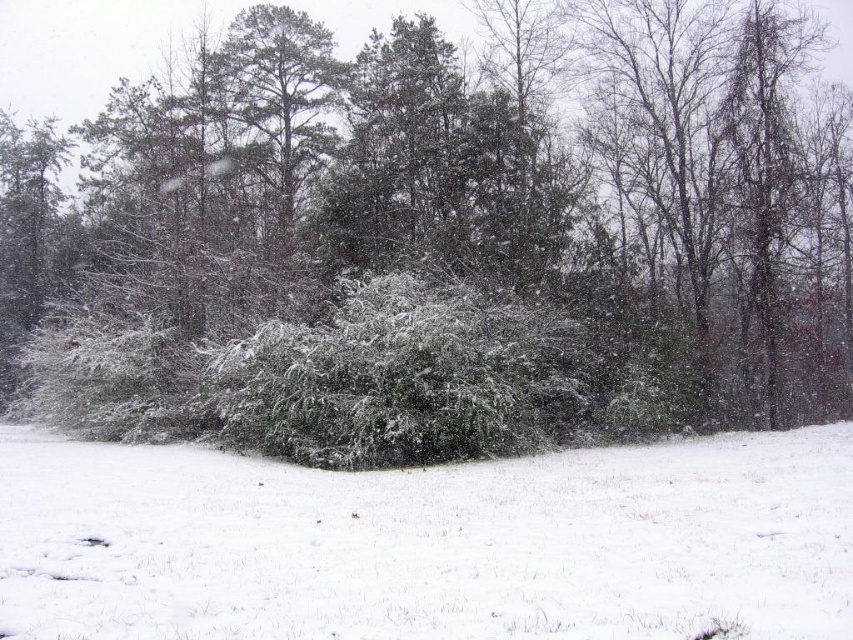
Can you confirm if green matte bush at center is positioned above white fluffy snow at center?

Yes.

Consider the image. Who is more forward, (549, 152) or (387, 598)?

Point (387, 598) is in front.

Find the location of a particular element. green matte bush at center is located at coordinates (444, 237).